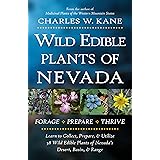
Image resolution: width=160 pixels, height=160 pixels. I want to click on blurry photo of a book, so click(35, 138).